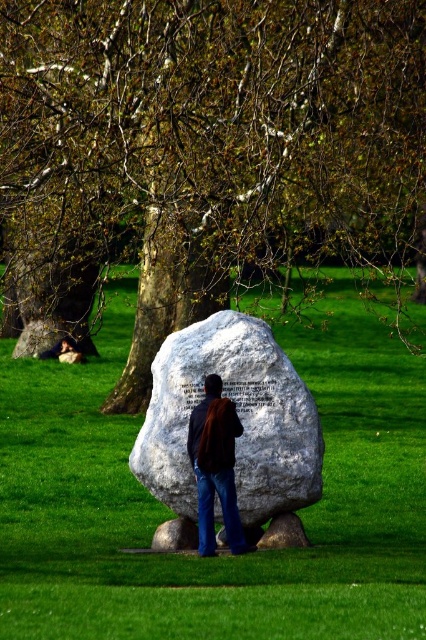
Question: Among these objects, which one is nearest to the camera?

Choices:
 (A) green grass at center
 (B) white stone boulder at center

Answer: (A)

Question: Does green leafy tree at center lie behind brown leather jacket at center?

Choices:
 (A) yes
 (B) no

Answer: (A)

Question: Does green grass at center appear under brown leather jacket at center?

Choices:
 (A) no
 (B) yes

Answer: (A)

Question: Which of the following is the closest to the observer?

Choices:
 (A) (210, 552)
 (B) (262, 440)

Answer: (A)

Question: Which point is farther to the camera?

Choices:
 (A) green grass at center
 (B) smooth brown hair at lower left

Answer: (B)

Question: Does green leafy tree at center appear under green grass at center?

Choices:
 (A) yes
 (B) no

Answer: (B)